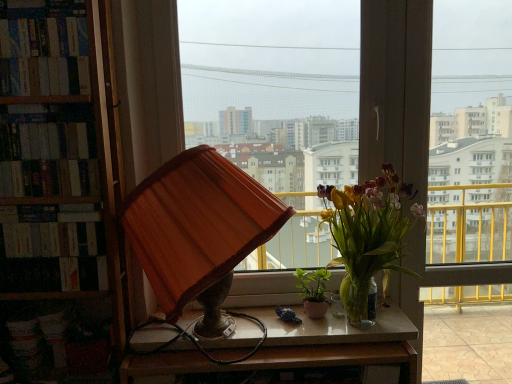
Question: From the image's perspective, relative to hardcover book at left, the 3th book in the top-to-bottom sequence, is hardcover books at left, the 3th book from the bottom, above or below?

Choices:
 (A) below
 (B) above

Answer: (B)

Question: In terms of height, does hardcover books at left, the 1th book when ordered from top to bottom, look taller or shorter compared to hardcover book at left, the 3th book in the top-to-bottom sequence?

Choices:
 (A) short
 (B) tall

Answer: (B)

Question: Which object is the closest to the wooden desk at center?

Choices:
 (A) hardcover books at left, the 3th book from the bottom
 (B) transparent glass window at center, positioned as the second window in left-to-right order
 (C) orange fabric lampshade at center
 (D) matte wooden lampshade at center, the second window positioned from the right
 (E) hardcover books at left, the second book ordered from the bottom

Answer: (C)

Question: Which of these objects is positioned farthest from the wooden desk at center?

Choices:
 (A) hardcover books at left, the 1th book when ordered from top to bottom
 (B) green matte plant at center, marked as the 1th houseplant in a left-to-right arrangement
 (C) hardcover book at left, the 3th book in the top-to-bottom sequence
 (D) hardcover books at left, the second book ordered from the bottom
 (E) translucent glass vase at center, placed as the second houseplant when sorted from left to right

Answer: (A)